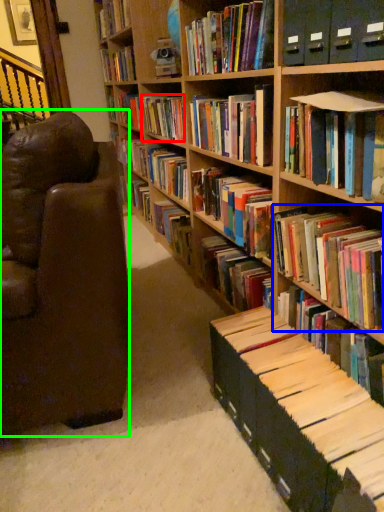
Question: Which object is positioned closest to book (highlighted by a red box)? Select from book (highlighted by a blue box) and chair (highlighted by a green box).

Choices:
 (A) book
 (B) chair

Answer: (B)